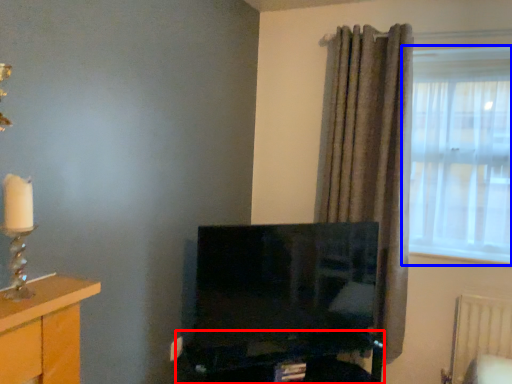
Question: Which point is further to the camera, computer desk (highlighted by a red box) or window (highlighted by a blue box)?

Choices:
 (A) computer desk
 (B) window

Answer: (B)